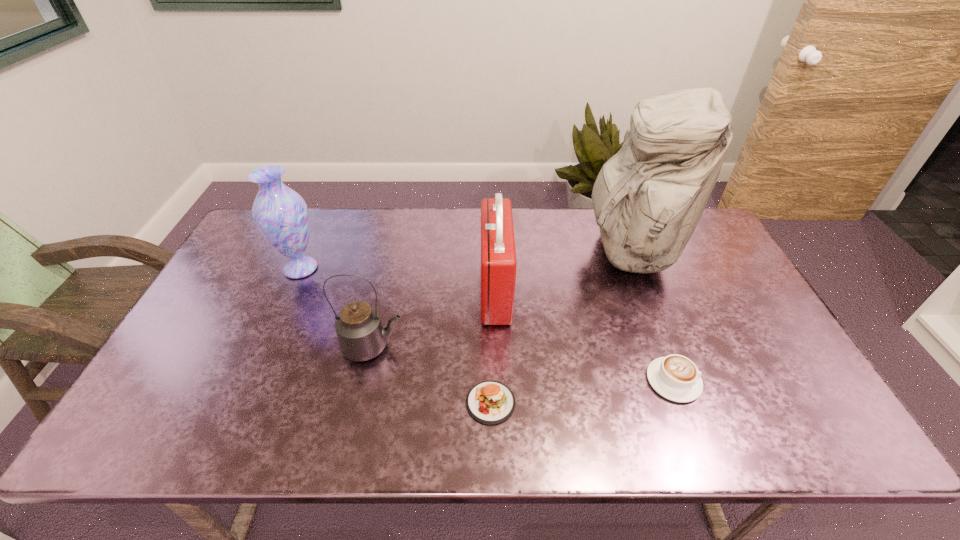
The image size is (960, 540). I want to click on backpack, so tap(648, 198).

Where is `the leftmost object`? This screenshot has width=960, height=540. the leftmost object is located at coordinates (281, 214).

You are a GUI agent. You are given a task and a screenshot of the screen. Output one action in this format:
    pyautogui.click(x=<x>, y=<y>)
    Task: Click on the first-aid kit
    The height and width of the screenshot is (540, 960).
    Given the screenshot: What is the action you would take?
    pyautogui.click(x=498, y=254)

You are a GUI agent. You are given a task and a screenshot of the screen. Output one action in this format:
    pyautogui.click(x=<x>, y=<y>)
    Task: Click on the third shortest object
    
    Given the screenshot: What is the action you would take?
    pyautogui.click(x=361, y=335)

Locate an element on the screen. This screenshot has height=540, width=960. the fifth object from right to left is located at coordinates (361, 335).

Locate an element on the screen. The image size is (960, 540). cappuccino is located at coordinates (675, 377).

The height and width of the screenshot is (540, 960). In order to click on patty (food) in this screenshot , I will do `click(490, 402)`.

Where is `free space located on the front-facing side of the tallest object`? The image size is (960, 540). free space located on the front-facing side of the tallest object is located at coordinates (497, 251).

What are the coordinates of `vacant area situated on the front-facing side of the tallest object` in the screenshot? It's located at (479, 251).

The width and height of the screenshot is (960, 540). In order to click on free space located 0.280m on the front-facing side of the tallest object in this screenshot , I will do `click(497, 251)`.